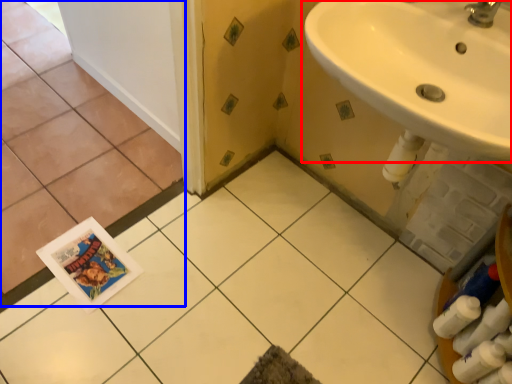
Question: Which point is further to the camera, sink (highlighted by a red box) or ceramic tile (highlighted by a blue box)?

Choices:
 (A) sink
 (B) ceramic tile

Answer: (B)